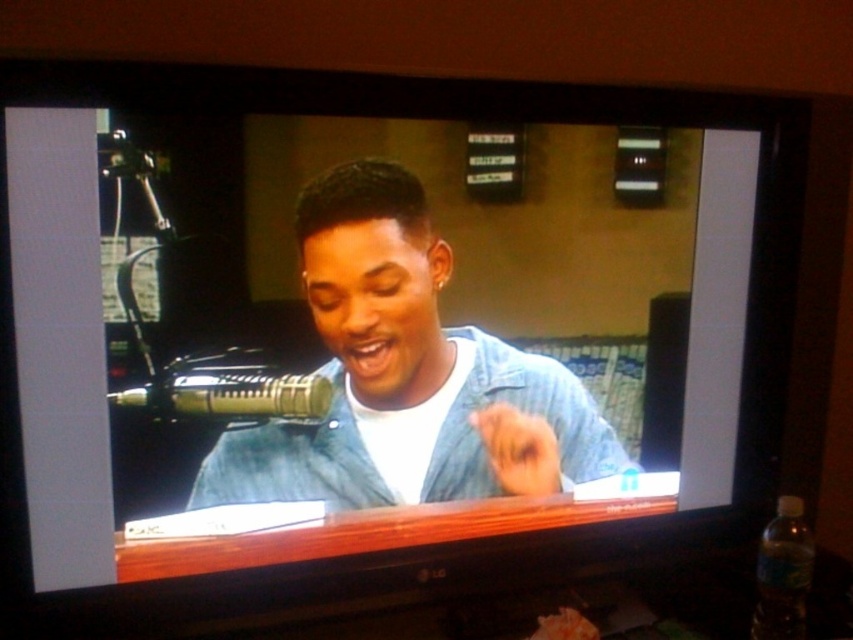
You are designing a poster for the radio show and need to include both the denim shirt at center and the metallic gold microphone at left. If you want to maintain their relative sizes from the original image, which object should you make bigger?

The denim shirt at center should be made bigger since it is larger in size than the metallic gold microphone at left in the original image.

You are an interior designer planning to place a new lamp in the studio. The lamp requires a space of 0.5 meters in diameter. Is there enough space at the point labeled point [405,376] where the denim shirt is located?

The denim shirt at center is located at point [405,376]. Since the lamp requires 0.5 meters in diameter, and there is space available at that point, the lamp can be placed there.